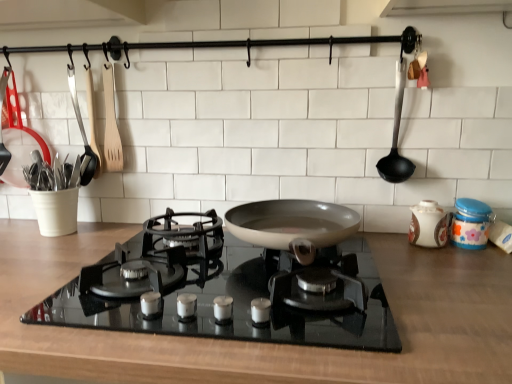
You are a GUI agent. You are given a task and a screenshot of the screen. Output one action in this format:
    pyautogui.click(x=<x>, y=<y>)
    Task: Click on the vacant space that is in between black glass gas stove at center and porcelain jar at right, which is counted as the 2th kitchen appliance, starting from the right
    This screenshot has height=384, width=512.
    Given the screenshot: What is the action you would take?
    pyautogui.click(x=403, y=269)